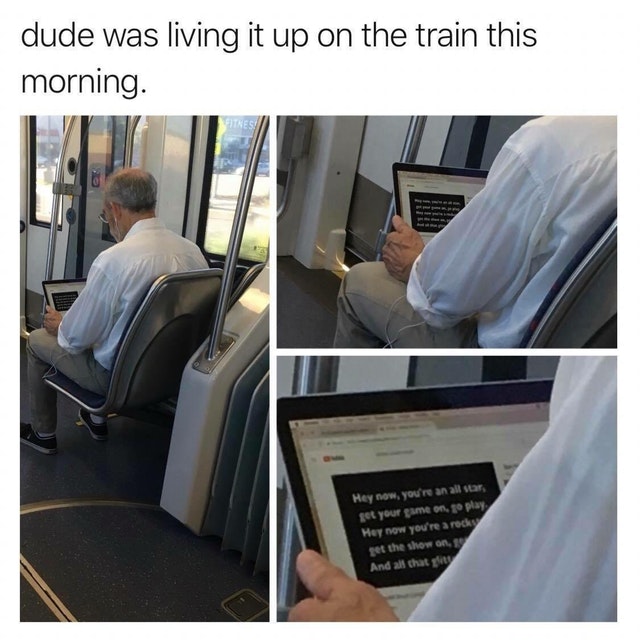
Identify the location of hand rails. Image resolution: width=640 pixels, height=642 pixels. (234, 220), (59, 162), (416, 131), (300, 122), (317, 375), (130, 137).